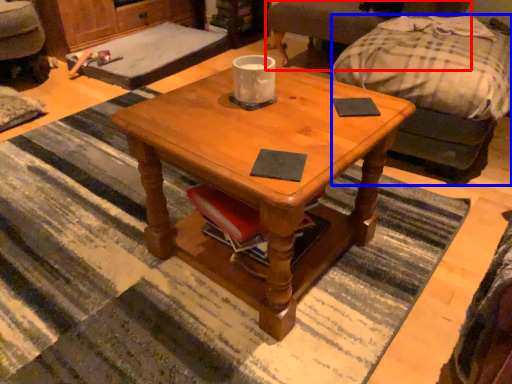
Question: Which point is closer to the camera, swivel chair (highlighted by a red box) or studio couch (highlighted by a blue box)?

Choices:
 (A) swivel chair
 (B) studio couch

Answer: (B)